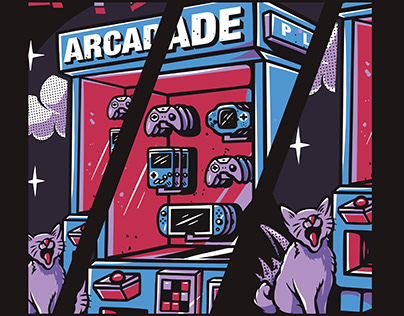
What are the coordinates of `arcade game` in the screenshot? It's located at (225, 57).